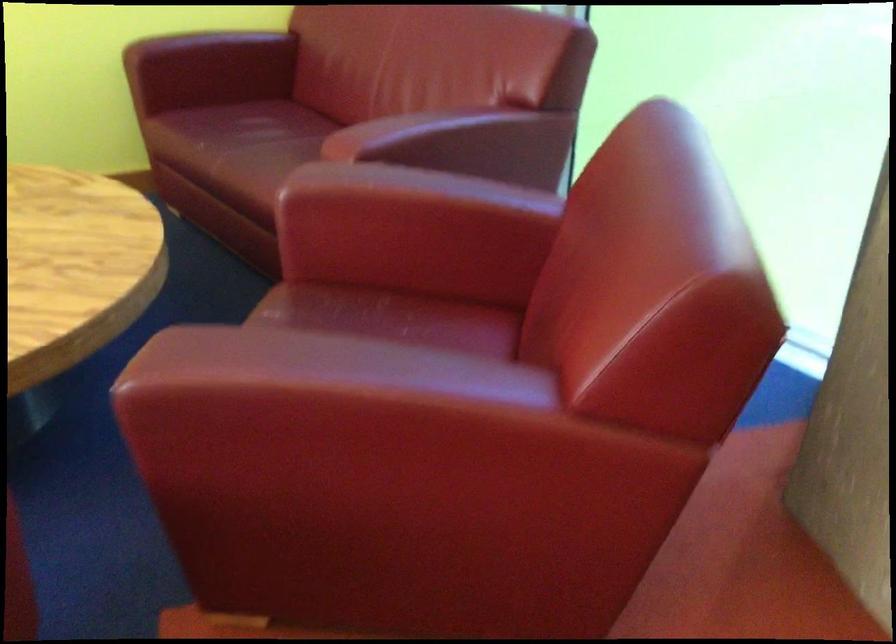
Find where to sit the red sofa sitting surface. Please return your answer as a coordinate pair (x, y).

(382, 315)